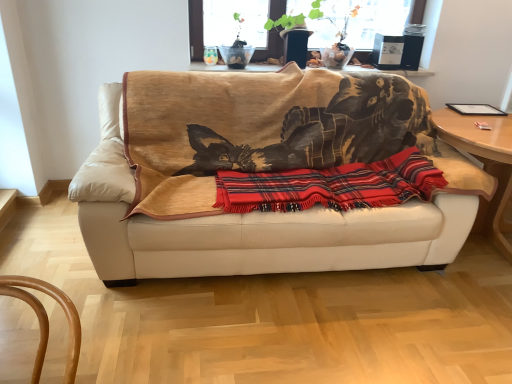
Question: Is red plaid blanket at center bigger or smaller than beige leather couch at center?

Choices:
 (A) small
 (B) big

Answer: (A)

Question: Considering their positions, is red plaid blanket at center located in front of or behind beige leather couch at center?

Choices:
 (A) behind
 (B) front

Answer: (A)

Question: Which of these objects is positioned closest to the beige leather couch at center?

Choices:
 (A) red plaid blanket at center
 (B) wooden round table at right, which appears as the second table when viewed from the top
 (C) wooden table at upper center, the second table when ordered from right to left

Answer: (A)

Question: Which of these objects is positioned farthest from the red plaid blanket at center?

Choices:
 (A) wooden table at upper center, which is the first table from top to bottom
 (B) wooden round table at right, the 1th table when ordered from right to left
 (C) beige leather couch at center

Answer: (A)